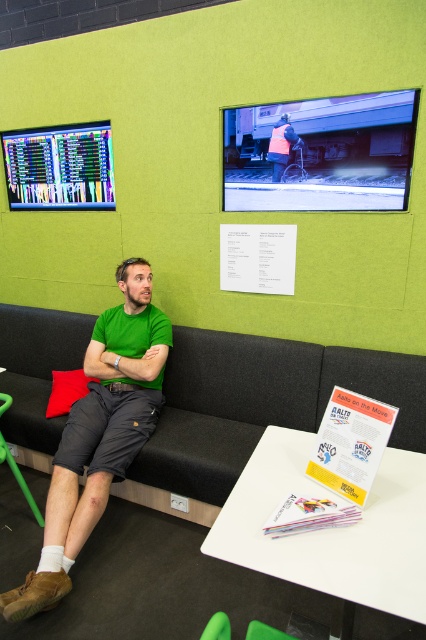
You are organizing a small event in this lounge and need to place a new decorative item. You have a large poster and a small statue. Which item should you place on the white paper at upper center and which on the green plastic chair at lower left based on their sizes?

The white paper at upper center has a smaller size compared to the green plastic chair at lower left. Therefore, the small statue should be placed on the white paper at upper center, and the large poster should be placed on the green plastic chair at lower left to match their sizes.